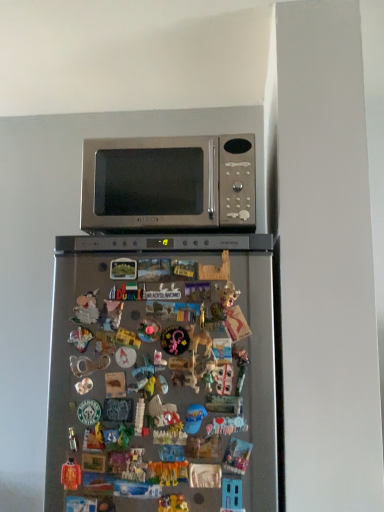
Question: In the image, is satin silver refrigerator at center positioned in front of or behind matte orange toy at lower left, the third toy positioned from the right?

Choices:
 (A) behind
 (B) front

Answer: (B)

Question: From their relative heights in the image, would you say satin silver refrigerator at center is taller or shorter than matte orange toy at lower left, the third toy positioned from the right?

Choices:
 (A) tall
 (B) short

Answer: (A)

Question: Which object is the farthest from the plastic toy at center, the 1th toy in the right-to-left sequence?

Choices:
 (A) satin silver refrigerator at center
 (B) matte orange toy at lower left, the third toy positioned from the right
 (C) multicolored plastic toy at center, which ranks as the second toy in left-to-right order
 (D) satin silver microwave at upper center

Answer: (D)

Question: Estimate the real-world distances between objects in this image. Which object is farther from the matte orange toy at lower left, the 1th toy viewed from the left?

Choices:
 (A) multicolored plastic toy at center, which ranks as the second toy in left-to-right order
 (B) plastic toy at center, the 1th toy in the right-to-left sequence
 (C) satin silver microwave at upper center
 (D) satin silver refrigerator at center

Answer: (C)